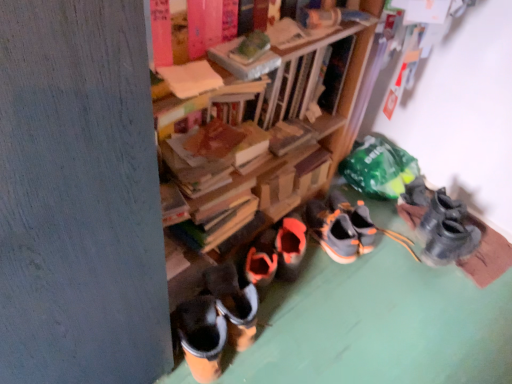
Question: From a real-world perspective, is orange rubber boots at lower left above or below wooden book at center, marked as the first book in a back-to-front arrangement?

Choices:
 (A) above
 (B) below

Answer: (B)

Question: Considering the positions of orange rubber boots at lower left and wooden book at center, placed as the 2th book when sorted from front to back, in the image, is orange rubber boots at lower left wider or thinner than wooden book at center, placed as the 2th book when sorted from front to back,?

Choices:
 (A) wide
 (B) thin

Answer: (A)

Question: Estimate the real-world distances between objects in this image. Which object is closer to the orange rubber boots at lower left?

Choices:
 (A) gray suede sneakers at center, which is counted as the 3th footwear, starting from the right
 (B) matte cardboard book at upper center, placed as the 2th book when sorted from back to front
 (C) wooden book at center, marked as the first book in a back-to-front arrangement
 (D) orange suede sneakers at center, positioned as the second footwear in right-to-left order
 (E) matte gray sneakers at right, which is the first footwear from right to left

Answer: (D)

Question: Which of these objects is positioned closest to the matte gray sneakers at right, which is the first footwear from right to left?

Choices:
 (A) wooden book at center, placed as the 2th book when sorted from front to back
 (B) orange rubber boots at lower left
 (C) matte cardboard book at upper center, positioned as the first book in front-to-back order
 (D) orange suede sneakers at center, the second footwear positioned from the left
 (E) gray suede sneakers at center, which is counted as the 3th footwear, starting from the right

Answer: (D)